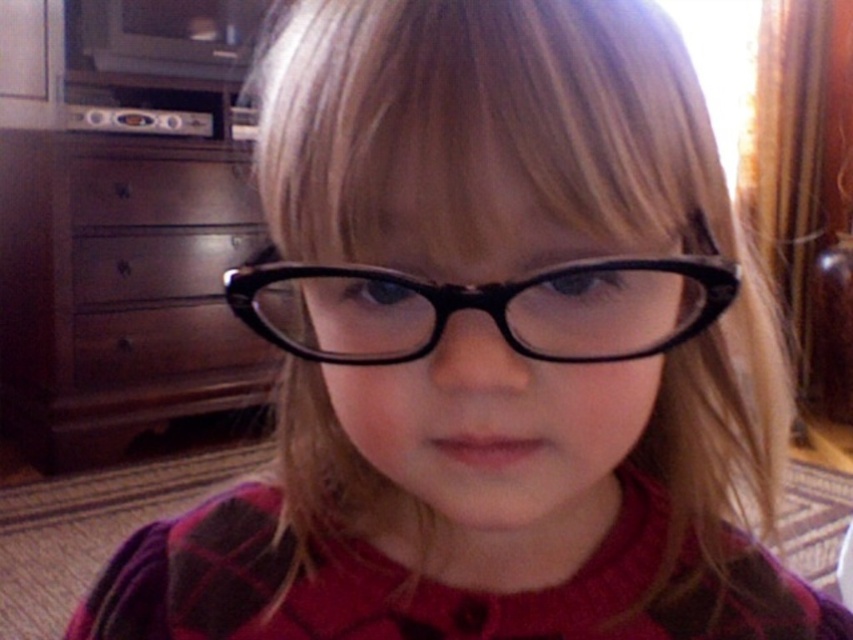
What is the exact position of the satin silver drawer at center in the image?

The satin silver drawer at center is located at point coordinates of 0.302 in the x axis and 0.190 in the y axis.

You are a parent trying to organize your child room. You have a brown wood dresser at left and a brown wood drawer at center. Which one is placed higher up?

The brown wood dresser at left is positioned over the brown wood drawer at center, so the dresser is higher up.

You are standing in a room and want to take a photo of the point at coordinates point (15, 214). If your camera is set to focus at 2 meters, will it be able to capture the point clearly?

The point (15, 214) is 2.35 meters away from the camera, which is beyond the 2 meter focus setting. Therefore, the camera may not capture the point clearly unless adjusted.